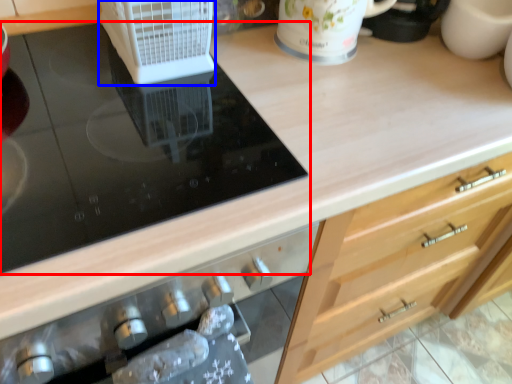
Question: Among these objects, which one is nearest to the camera, gas stove (highlighted by a red box) or kitchen appliance (highlighted by a blue box)?

Choices:
 (A) gas stove
 (B) kitchen appliance

Answer: (A)